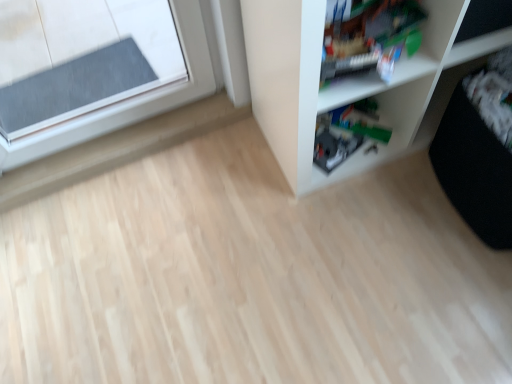
Question: From the image's perspective, is translucent plastic toy at upper right under white plastic shelf at upper right?

Choices:
 (A) no
 (B) yes

Answer: (B)

Question: Is white plastic shelf at upper right at the back of translucent plastic toy at upper right?

Choices:
 (A) no
 (B) yes

Answer: (B)

Question: Does translucent plastic toy at upper right appear on the right side of white plastic shelf at upper right?

Choices:
 (A) no
 (B) yes

Answer: (A)

Question: Is translucent plastic toy at upper right outside of white plastic shelf at upper right?

Choices:
 (A) no
 (B) yes

Answer: (A)

Question: Can you see translucent plastic toy at upper right touching white plastic shelf at upper right?

Choices:
 (A) no
 (B) yes

Answer: (A)

Question: Does translucent plastic toy at upper right have a smaller size compared to white plastic shelf at upper right?

Choices:
 (A) yes
 (B) no

Answer: (A)

Question: Would you consider white plastic shelf at upper right to be distant from translucent plastic toy at upper right?

Choices:
 (A) no
 (B) yes

Answer: (A)

Question: From a real-world perspective, is white plastic shelf at upper right on top of translucent plastic toy at upper right?

Choices:
 (A) yes
 (B) no

Answer: (B)

Question: From the image's perspective, is white plastic shelf at upper right below translucent plastic toy at upper right?

Choices:
 (A) no
 (B) yes

Answer: (A)

Question: From the image's perspective, is white plastic shelf at upper right above translucent plastic toy at upper right?

Choices:
 (A) no
 (B) yes

Answer: (B)

Question: Can you confirm if white plastic shelf at upper right is smaller than translucent plastic toy at upper right?

Choices:
 (A) no
 (B) yes

Answer: (A)

Question: Considering the relative sizes of white plastic shelf at upper right and translucent plastic toy at upper right in the image provided, is white plastic shelf at upper right taller than translucent plastic toy at upper right?

Choices:
 (A) no
 (B) yes

Answer: (B)

Question: Is white plastic shelf at upper right bigger or smaller than translucent plastic toy at upper right?

Choices:
 (A) big
 (B) small

Answer: (A)